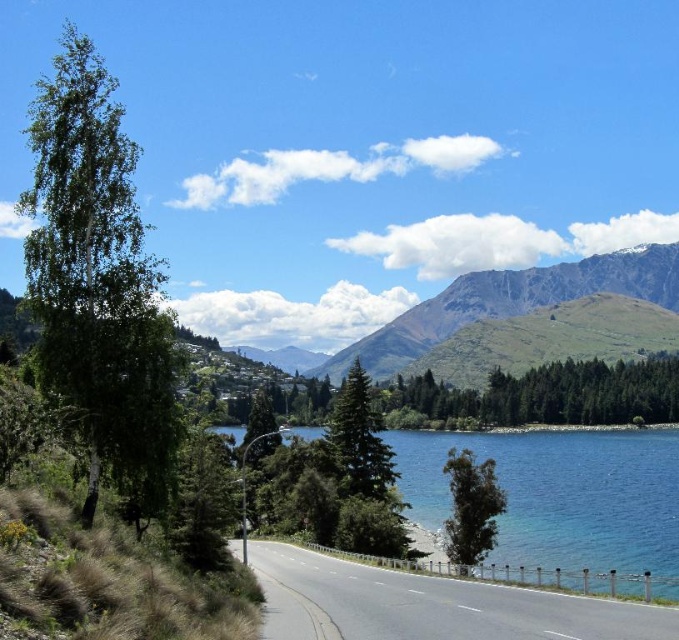
Question: Where is blue glassy water at center located in relation to green leafy tree at lower center in the image?

Choices:
 (A) below
 (B) above

Answer: (A)

Question: Which of these objects is positioned closest to the green textured tree at center?

Choices:
 (A) blue glassy water at center
 (B) asphalt road at lower center
 (C) green matte tree at left

Answer: (A)

Question: Which point is closer to the camera?

Choices:
 (A) green textured tree at center
 (B) green matte tree at left
 (C) green textured mountain at upper center
 (D) green leafy tree at lower center

Answer: (B)

Question: Is asphalt road at lower center smaller than green textured tree at center?

Choices:
 (A) yes
 (B) no

Answer: (A)

Question: Is green matte tree at left to the right of green textured tree at center from the viewer's perspective?

Choices:
 (A) no
 (B) yes

Answer: (A)

Question: Which point appears farthest from the camera in this image?

Choices:
 (A) (604, 541)
 (B) (454, 312)

Answer: (B)